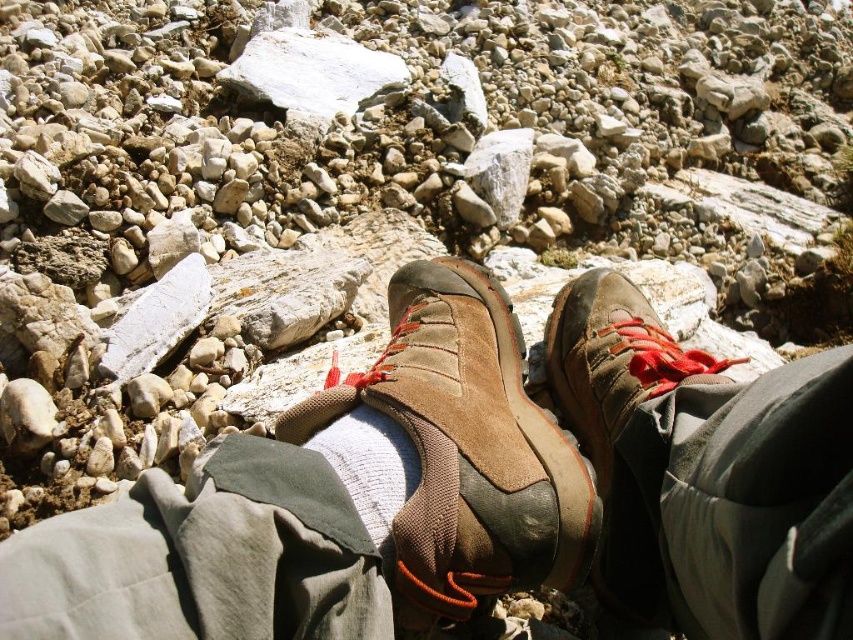
Is brown suede shoe at center positioned at the back of white cotton sock at center?

Yes.

Who is taller, brown suede shoe at center or white cotton sock at center?

Standing taller between the two is brown suede shoe at center.

Find the location of a particular element. The width and height of the screenshot is (853, 640). brown suede shoe at center is located at coordinates (x=612, y=362).

How distant is brown suede shoes at center from brown suede shoe at center?

brown suede shoes at center is 4.55 inches away from brown suede shoe at center.

What do you see at coordinates (480, 490) in the screenshot?
I see `brown suede shoes at center` at bounding box center [480, 490].

Locate an element on the screen. brown suede shoes at center is located at coordinates (480, 490).

Does suede/leather boot at center appear on the right side of white cotton sock at center?

Yes, suede/leather boot at center is to the right of white cotton sock at center.

Image resolution: width=853 pixels, height=640 pixels. I want to click on suede/leather boot at center, so click(463, 449).

Is point (378, 358) behind point (351, 452)?

Yes.

What are the coordinates of `suede/leather boot at center` in the screenshot? It's located at (463, 449).